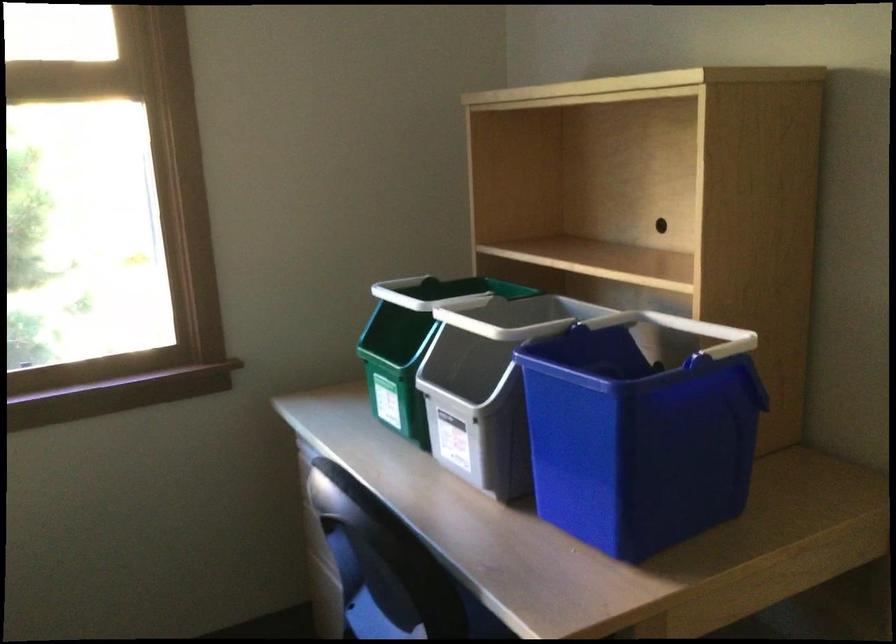
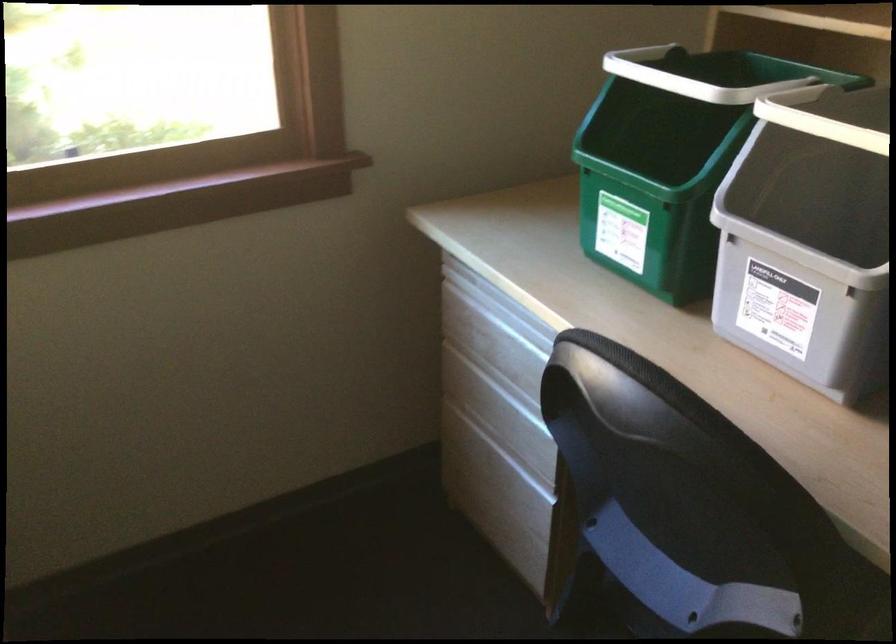
Question: The first image is from the beginning of the video and the second image is from the end. How did the camera likely rotate when shooting the video?

Choices:
 (A) Left
 (B) Right
 (C) Up
 (D) Down

Answer: (D)